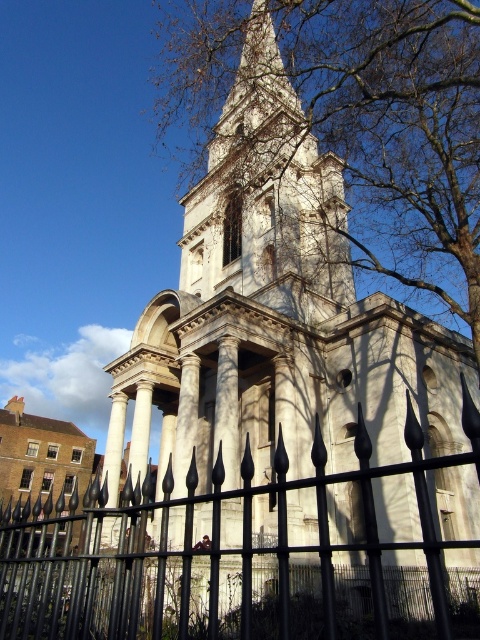
Does black wrought iron fence at lower left have a lesser height compared to white stone bell tower at upper center?

Indeed, black wrought iron fence at lower left has a lesser height compared to white stone bell tower at upper center.

Is black wrought iron fence at lower left taller than white stone bell tower at upper center?

Incorrect, black wrought iron fence at lower left's height is not larger of white stone bell tower at upper center's.

Between point (160, 532) and point (292, 216), which one is positioned in front?

Point (160, 532) is in front.

In order to click on black wrought iron fence at lower left in this screenshot , I will do `click(203, 547)`.

Which is above, bare branches at upper center or white stone bell tower at upper center?

bare branches at upper center is higher up.

Who is taller, bare branches at upper center or white stone bell tower at upper center?

bare branches at upper center is taller.

The height and width of the screenshot is (640, 480). I want to click on bare branches at upper center, so pyautogui.click(x=355, y=116).

Is bare branches at upper center smaller than black wrought iron fence at lower left?

Actually, bare branches at upper center might be larger than black wrought iron fence at lower left.

Which is behind, point (468, 294) or point (40, 531)?

The point (40, 531) is behind.

Locate an element on the screen. This screenshot has height=640, width=480. bare branches at upper center is located at coordinates (355, 116).